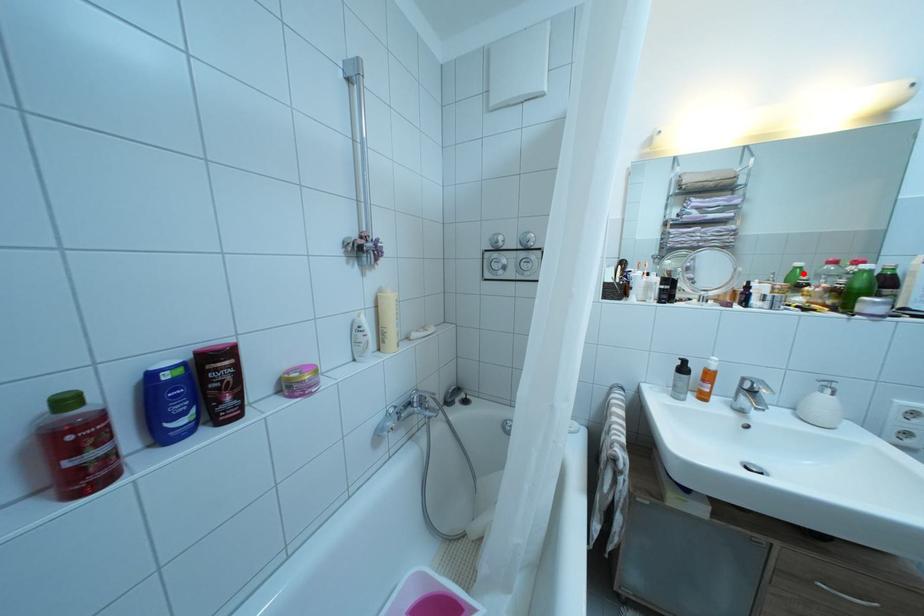
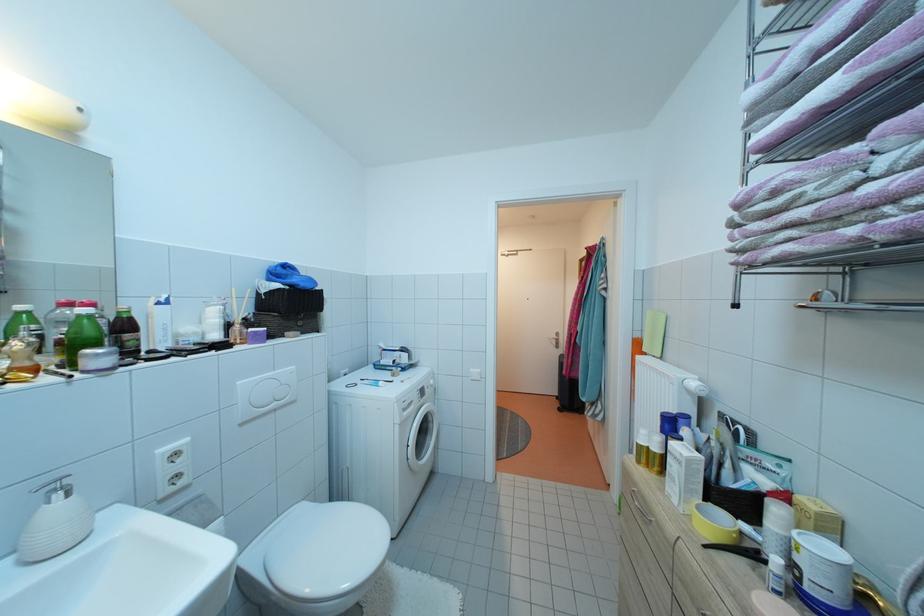
Locate, in the second image, the point that corresponds to the highlighted location in the first image.

(28, 318)